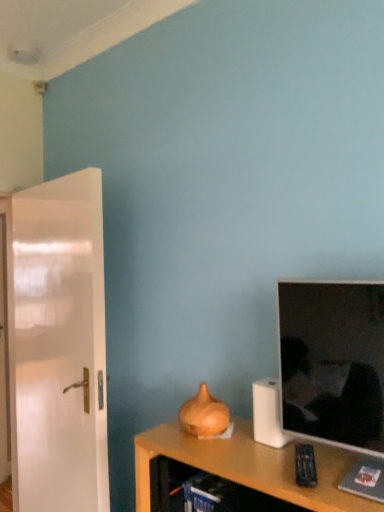
This screenshot has height=512, width=384. What do you see at coordinates (305, 466) in the screenshot?
I see `black plastic remote control at lower right` at bounding box center [305, 466].

The height and width of the screenshot is (512, 384). Identify the location of black plastic remote control at lower right. (305, 466).

The height and width of the screenshot is (512, 384). Identify the location of black plastic remote control at lower right. (305, 466).